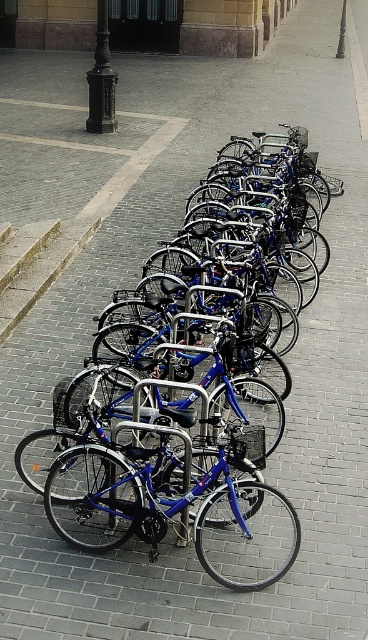
Does shiny blue bicycle at center appear on the right side of black metal pole at upper center?

No, shiny blue bicycle at center is not to the right of black metal pole at upper center.

Is the position of shiny blue bicycle at center more distant than that of black metal pole at upper center?

No, shiny blue bicycle at center is in front of black metal pole at upper center.

Who is more distant from viewer, (71, 545) or (342, 35)?

Point (342, 35)

You are a GUI agent. You are given a task and a screenshot of the screen. Output one action in this format:
    pyautogui.click(x=<x>, y=<y>)
    Task: Click on the shiny blue bicycle at center
    Image resolution: width=368 pixels, height=640 pixels.
    Given the screenshot: What is the action you would take?
    pyautogui.click(x=177, y=506)

The height and width of the screenshot is (640, 368). What do you see at coordinates (41, 273) in the screenshot?
I see `gray concrete curb at lower left` at bounding box center [41, 273].

Is gray concrete curb at lower left bigger than black metal pole at upper left?

Correct, gray concrete curb at lower left is larger in size than black metal pole at upper left.

Where is `gray concrete curb at lower left`? gray concrete curb at lower left is located at coordinates (41, 273).

What do you see at coordinates (101, 80) in the screenshot?
I see `black polished metal pole at upper left` at bounding box center [101, 80].

Which is above, black polished metal pole at upper left or black metal pole at upper left?

black metal pole at upper left is higher up.

Where is `black polished metal pole at upper left`? black polished metal pole at upper left is located at coordinates (101, 80).